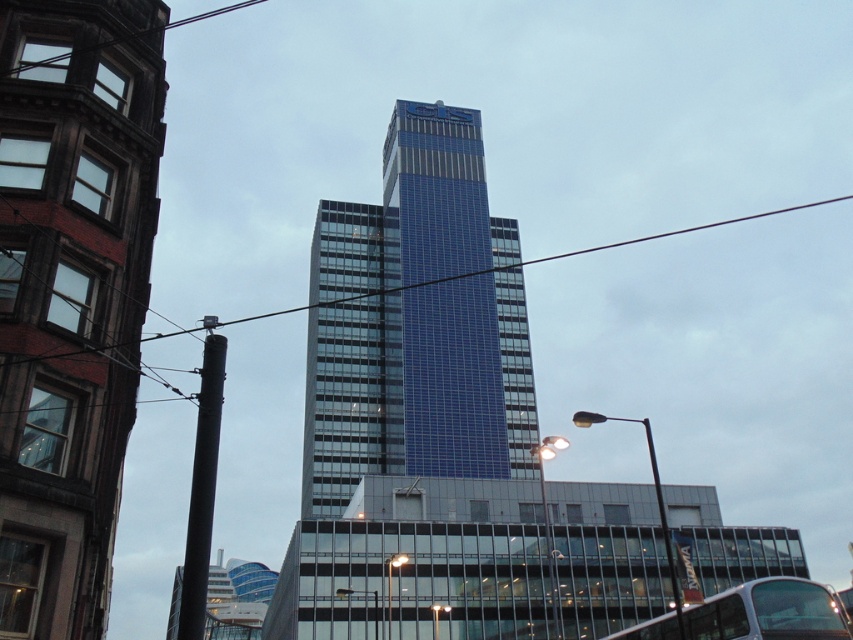
Question: In this image, where is blue glassy tower at center located relative to silver metallic bus at lower right?

Choices:
 (A) above
 (B) below

Answer: (A)

Question: Which point is farther from the camera taking this photo?

Choices:
 (A) (485, 417)
 (B) (415, 188)

Answer: (B)

Question: Which point appears closest to the camera in this image?

Choices:
 (A) (793, 636)
 (B) (340, 326)
 (C) (444, 225)

Answer: (A)

Question: Can you confirm if blue glassy tower at center is smaller than blue glass building at center?

Choices:
 (A) yes
 (B) no

Answer: (B)

Question: Considering the relative positions of blue glass building at center and silver metallic bus at lower right in the image provided, where is blue glass building at center located with respect to silver metallic bus at lower right?

Choices:
 (A) right
 (B) left

Answer: (B)

Question: Which of the following is the closest to the observer?

Choices:
 (A) blue glassy tower at center
 (B) blue glass building at center
 (C) silver metallic bus at lower right

Answer: (C)